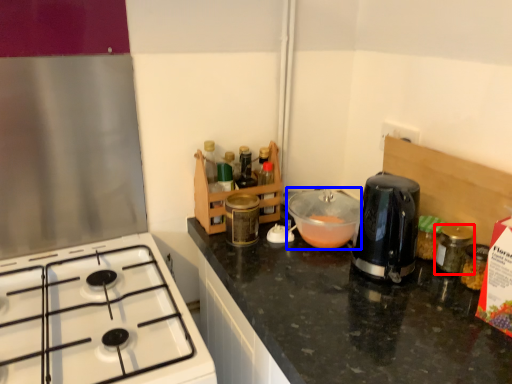
Question: Which object appears farthest to the camera in this image, bottle (highlighted by a red box) or bowl (highlighted by a blue box)?

Choices:
 (A) bottle
 (B) bowl

Answer: (B)